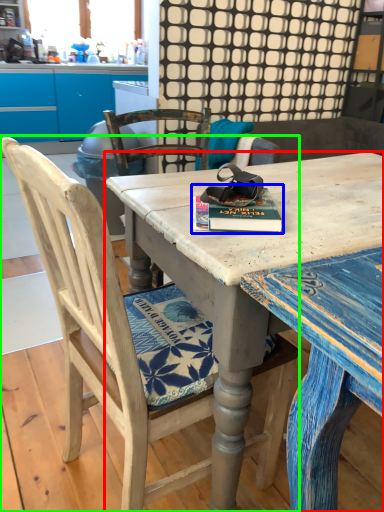
Question: Estimate the real-world distances between objects in this image. Which object is farther from desk (highlighted by a red box), paperback book (highlighted by a blue box) or chair (highlighted by a green box)?

Choices:
 (A) paperback book
 (B) chair

Answer: (B)